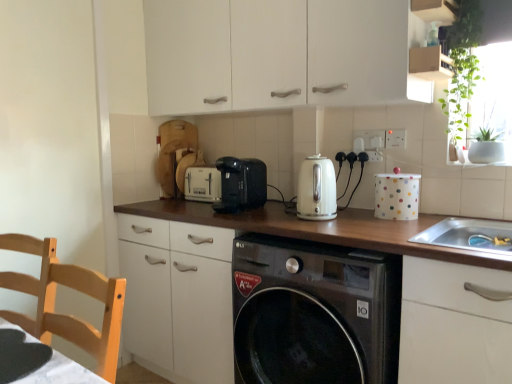
Question: Is white plastic toaster at center, the 2th appliance when ordered from front to back, taller or shorter than green leafy plant at upper right?

Choices:
 (A) short
 (B) tall

Answer: (A)

Question: Based on their sizes in the image, would you say white plastic toaster at center, the 2th appliance when ordered from front to back, is bigger or smaller than green leafy plant at upper right?

Choices:
 (A) big
 (B) small

Answer: (B)

Question: Which object is the closest to the white plastic electric outlet at upper right, the 2th electric outlet viewed from the back?

Choices:
 (A) green leafy plant at upper right
 (B) white plastic electric outlet at upper center, which appears as the second electric outlet when viewed from the right
 (C) black matte table at lower left
 (D) white plastic toaster at center, which is the 2th appliance in right-to-left order
 (E) black plastic toaster at center

Answer: (B)

Question: Considering the real-world distances, which object is farthest from the white glossy kettle at center?

Choices:
 (A) black plastic toaster at center
 (B) black matte table at lower left
 (C) green leafy plant at upper right
 (D) black glossy washing machine at center
 (E) white matte cabinet at upper center

Answer: (B)